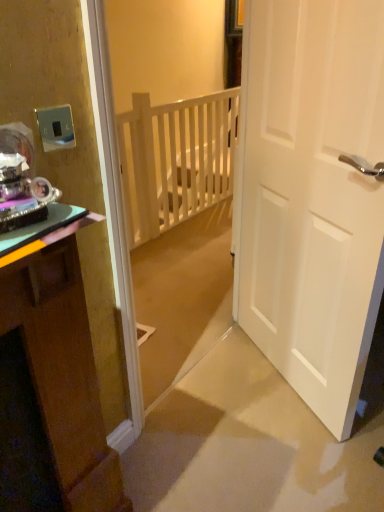
Question: Does green glossy cabinet at left come in front of white wooden balustrade at center?

Choices:
 (A) yes
 (B) no

Answer: (A)

Question: Is green glossy cabinet at left bigger than white wooden balustrade at center?

Choices:
 (A) no
 (B) yes

Answer: (A)

Question: Does green glossy cabinet at left have a lesser width compared to white wooden balustrade at center?

Choices:
 (A) yes
 (B) no

Answer: (B)

Question: Is white wooden balustrade at center located within green glossy cabinet at left?

Choices:
 (A) no
 (B) yes

Answer: (A)

Question: Is green glossy cabinet at left looking in the opposite direction of white wooden balustrade at center?

Choices:
 (A) yes
 (B) no

Answer: (B)

Question: From their relative heights in the image, would you say white wooden balustrade at center is taller or shorter than white matte door at right?

Choices:
 (A) tall
 (B) short

Answer: (B)

Question: Looking at their shapes, would you say white wooden balustrade at center is wider or thinner than white matte door at right?

Choices:
 (A) thin
 (B) wide

Answer: (B)

Question: From a real-world perspective, is white wooden balustrade at center positioned above or below white matte door at right?

Choices:
 (A) above
 (B) below

Answer: (B)

Question: Is white wooden balustrade at center spatially inside white matte door at right, or outside of it?

Choices:
 (A) outside
 (B) inside

Answer: (A)

Question: Considering the positions of white matte door at right and green glossy cabinet at left in the image, is white matte door at right bigger or smaller than green glossy cabinet at left?

Choices:
 (A) big
 (B) small

Answer: (B)

Question: In terms of height, does white matte door at right look taller or shorter compared to green glossy cabinet at left?

Choices:
 (A) tall
 (B) short

Answer: (A)

Question: Considering the positions of point (324, 314) and point (104, 479), is point (324, 314) closer or farther from the camera than point (104, 479)?

Choices:
 (A) farther
 (B) closer

Answer: (A)

Question: Considering their positions, is white matte door at right located in front of or behind green glossy cabinet at left?

Choices:
 (A) front
 (B) behind

Answer: (B)

Question: Considering the positions of green glossy cabinet at left and metallic silver switch at upper left in the image, is green glossy cabinet at left bigger or smaller than metallic silver switch at upper left?

Choices:
 (A) big
 (B) small

Answer: (A)

Question: From a real-world perspective, is green glossy cabinet at left physically located above or below metallic silver switch at upper left?

Choices:
 (A) above
 (B) below

Answer: (B)